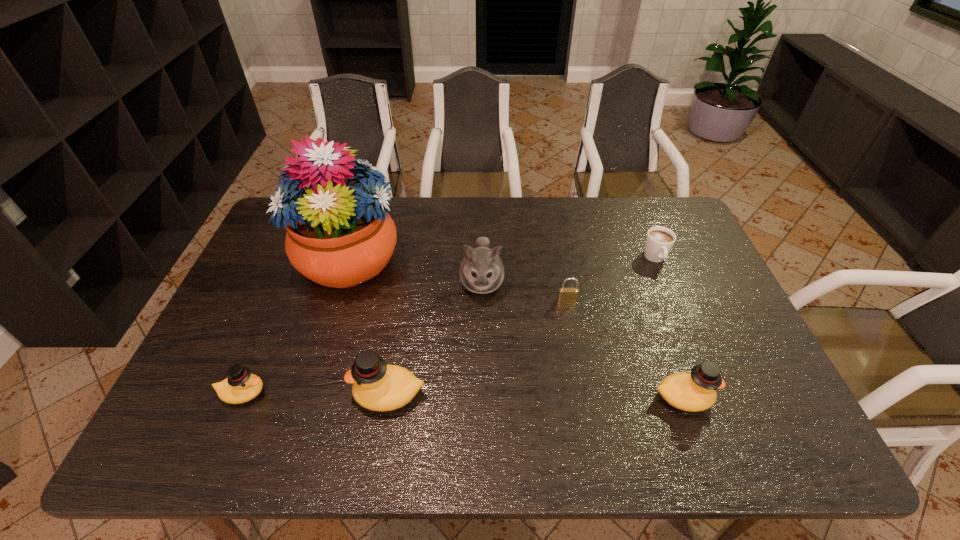
This screenshot has height=540, width=960. In order to click on object that can be found as the second closest to the cappuccino in this screenshot , I will do `click(696, 391)`.

Point out which object is positioned as the fourth nearest to the flower arrangement. Please provide its 2D coordinates. Your answer should be formatted as a tuple, i.e. [(x, y)], where the tuple contains the x and y coordinates of a point satisfying the conditions above.

[(566, 295)]

This screenshot has width=960, height=540. Identify the location of the third closest duck to the cappuccino. (241, 386).

Locate an element on the screen. Image resolution: width=960 pixels, height=540 pixels. duck that is the third nearest to the padlock is located at coordinates (241, 386).

At what (x,y) coordinates should I click in order to perform the action: click on free space that satisfies the following two spatial constraints: 1. on the front-facing side of the third object from right to left; 2. on the front-facing side of the shortest duck. Please return your answer as a coordinate pair (x, y). This screenshot has width=960, height=540. Looking at the image, I should click on (585, 393).